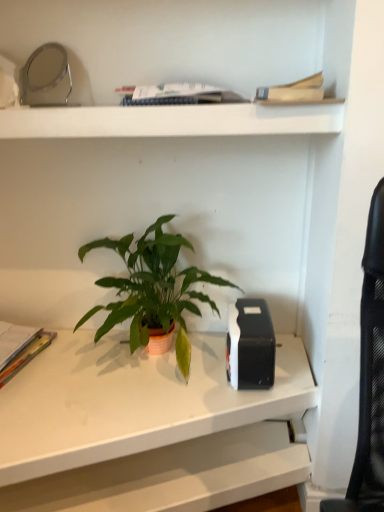
Describe the element at coordinates (293, 91) in the screenshot. The height and width of the screenshot is (512, 384). I see `hardcover book at upper center, acting as the second paperback book starting from the back` at that location.

What is the approximate width of white matte shelf at upper center?

16.49 inches.

What do you see at coordinates (26, 355) in the screenshot?
I see `multicolored paper at left, the second paperback book viewed from the right` at bounding box center [26, 355].

I want to click on multicolored paper at left, the first paperback book when ordered from back to front, so click(x=26, y=355).

The height and width of the screenshot is (512, 384). I want to click on white matte desk at center, so click(146, 428).

Does green matte houseplant at center turn towards multicolored paper at left, the first paperback book when ordered from back to front?

No, green matte houseplant at center is not oriented towards multicolored paper at left, the first paperback book when ordered from back to front.

In terms of height, does green matte houseplant at center look taller or shorter compared to multicolored paper at left, positioned as the 2th paperback book in top-to-bottom order?

green matte houseplant at center is taller than multicolored paper at left, positioned as the 2th paperback book in top-to-bottom order.

In the scene shown: Is green matte houseplant at center placed right next to multicolored paper at left, the first paperback book when ordered from back to front?

No.

From a real-world perspective, is white matte desk at center beneath green matte houseplant at center?

Answer: Yes.

Based on the photo, is white matte desk at center in front of or behind green matte houseplant at center in the image?

Clearly, white matte desk at center is in front of green matte houseplant at center.

Considering the sizes of white matte desk at center and green matte houseplant at center in the image, is white matte desk at center bigger or smaller than green matte houseplant at center?

Clearly, white matte desk at center is larger in size than green matte houseplant at center.

Is green matte houseplant at center at the back of white matte desk at center?

No, white matte desk at center's orientation is not away from green matte houseplant at center.

Is multicolored paper at left, which is counted as the first paperback book, starting from the left, spatially inside white matte shelf at upper center, or outside of it?

multicolored paper at left, which is counted as the first paperback book, starting from the left, lies outside white matte shelf at upper center.

From a real-world perspective, between multicolored paper at left, which is counted as the first paperback book, starting from the left, and white matte shelf at upper center, who is vertically lower?

multicolored paper at left, which is counted as the first paperback book, starting from the left, is physically lower.

Is multicolored paper at left, arranged as the second paperback book when viewed from the front, in front of white matte shelf at upper center?

No, multicolored paper at left, arranged as the second paperback book when viewed from the front, is further to the viewer.

Does point (157, 271) appear closer or farther from the camera than point (294, 98)?

Clearly, point (157, 271) is more distant from the camera than point (294, 98).

Would you say green matte houseplant at center is outside hardcover book at upper center, which is the first paperback book from front to back?

Yes, green matte houseplant at center is located beyond the bounds of hardcover book at upper center, which is the first paperback book from front to back.

Who is bigger, green matte houseplant at center or hardcover book at upper center, which ranks as the first paperback book in right-to-left order?

With larger size is green matte houseplant at center.

Where is `paperback book that is in front of the green matte houseplant at center`? The width and height of the screenshot is (384, 512). paperback book that is in front of the green matte houseplant at center is located at coordinates (293, 91).

From the image's perspective, between white matte shelf at upper center and hardcover book at upper center, the second paperback book in the bottom-to-top sequence, which one is located above?

hardcover book at upper center, the second paperback book in the bottom-to-top sequence.

Is there a large distance between white matte shelf at upper center and hardcover book at upper center, which is the first paperback book from front to back?

No.

The width and height of the screenshot is (384, 512). Find the location of `shelf located in front of the hardcover book at upper center, acting as the second paperback book starting from the back`. shelf located in front of the hardcover book at upper center, acting as the second paperback book starting from the back is located at coordinates [171, 121].

Consider the image. Can we say white matte shelf at upper center lies outside hardcover book at upper center, acting as the second paperback book starting from the back?

That's correct, white matte shelf at upper center is outside of hardcover book at upper center, acting as the second paperback book starting from the back.

How different are the orientations of white matte desk at center and hardcover book at upper center, acting as the second paperback book starting from the back, in degrees?

1.13 degrees separate the facing orientations of white matte desk at center and hardcover book at upper center, acting as the second paperback book starting from the back.

Which point is more forward, (71, 421) or (321, 93)?

The point (321, 93) is more forward.

From a real-world perspective, which is physically above, white matte desk at center or hardcover book at upper center, which is the first paperback book from front to back?

From a 3D spatial view, hardcover book at upper center, which is the first paperback book from front to back, is above.

Can you confirm if white matte desk at center is wider than hardcover book at upper center, the second paperback book in the bottom-to-top sequence?

Correct, the width of white matte desk at center exceeds that of hardcover book at upper center, the second paperback book in the bottom-to-top sequence.

Is hardcover book at upper center, which ranks as the 2th paperback book in left-to-right order, beside multicolored paper at left, the second paperback book viewed from the right?

No, hardcover book at upper center, which ranks as the 2th paperback book in left-to-right order, is not with multicolored paper at left, the second paperback book viewed from the right.

Does hardcover book at upper center, acting as the second paperback book starting from the back, have a lesser width compared to multicolored paper at left, arranged as the second paperback book when viewed from the front?

Yes.

From a real-world perspective, is hardcover book at upper center, acting as the second paperback book starting from the back, physically located above or below multicolored paper at left, arranged as the second paperback book when viewed from the front?

Clearly, from a real-world perspective, hardcover book at upper center, acting as the second paperback book starting from the back, is above multicolored paper at left, arranged as the second paperback book when viewed from the front.

Consider the image. Can multicolored paper at left, the second paperback book viewed from the right, be found inside hardcover book at upper center, which is the first paperback book from front to back?

No, hardcover book at upper center, which is the first paperback book from front to back, does not contain multicolored paper at left, the second paperback book viewed from the right.

Locate an element on the screen. The height and width of the screenshot is (512, 384). paperback book behind the green matte houseplant at center is located at coordinates (26, 355).

This screenshot has width=384, height=512. I want to click on desk below the green matte houseplant at center (from the image's perspective), so click(146, 428).

Based on their spatial positions, is multicolored paper at left, which is the first paperback book in bottom-to-top order, or hardcover book at upper center, which is the first paperback book from front to back, closer to white matte shelf at upper center?

hardcover book at upper center, which is the first paperback book from front to back, is closer to white matte shelf at upper center.

Looking at the image, which one is located closer to white matte desk at center, green matte houseplant at center or multicolored paper at left, the first paperback book when ordered from back to front?

The object closer to white matte desk at center is green matte houseplant at center.

Which object lies further to the anchor point multicolored paper at left, the first paperback book when ordered from back to front, hardcover book at upper center, the 1th paperback book viewed from the top, or white matte shelf at upper center?

Among the two, hardcover book at upper center, the 1th paperback book viewed from the top, is located further to multicolored paper at left, the first paperback book when ordered from back to front.

Which object lies further to the anchor point multicolored paper at left, which is the first paperback book in bottom-to-top order, white matte shelf at upper center or white matte desk at center?

Among the two, white matte shelf at upper center is located further to multicolored paper at left, which is the first paperback book in bottom-to-top order.

When comparing their distances from white matte desk at center, does hardcover book at upper center, which ranks as the 2th paperback book in left-to-right order, or green matte houseplant at center seem further?

hardcover book at upper center, which ranks as the 2th paperback book in left-to-right order, is further to white matte desk at center.

Considering their positions, is green matte houseplant at center positioned further to multicolored paper at left, the first paperback book when ordered from back to front, than hardcover book at upper center, which is the first paperback book from front to back?

hardcover book at upper center, which is the first paperback book from front to back, is positioned further to the anchor multicolored paper at left, the first paperback book when ordered from back to front.

Looking at the image, which one is located closer to white matte shelf at upper center, hardcover book at upper center, the second paperback book in the bottom-to-top sequence, or multicolored paper at left, positioned as the 2th paperback book in top-to-bottom order?

Among the two, hardcover book at upper center, the second paperback book in the bottom-to-top sequence, is located nearer to white matte shelf at upper center.

Considering their positions, is multicolored paper at left, arranged as the second paperback book when viewed from the front, positioned further to green matte houseplant at center than white matte desk at center?

multicolored paper at left, arranged as the second paperback book when viewed from the front.

The width and height of the screenshot is (384, 512). What are the coordinates of `desk situated between multicolored paper at left, positioned as the 2th paperback book in top-to-bottom order, and green matte houseplant at center from left to right` in the screenshot? It's located at (146, 428).

Find the location of `shelf between hardcover book at upper center, the 1th paperback book viewed from the top, and white matte desk at center from top to bottom`. shelf between hardcover book at upper center, the 1th paperback book viewed from the top, and white matte desk at center from top to bottom is located at coordinates (171, 121).

At what (x,y) coordinates should I click in order to perform the action: click on paperback book that lies between hardcover book at upper center, which ranks as the first paperback book in right-to-left order, and white matte desk at center from top to bottom. Please return your answer as a coordinate pair (x, y). The height and width of the screenshot is (512, 384). Looking at the image, I should click on point(26,355).

This screenshot has height=512, width=384. What are the coordinates of `houseplant between white matte shelf at upper center and white matte desk at center in the vertical direction` in the screenshot? It's located at (152, 289).